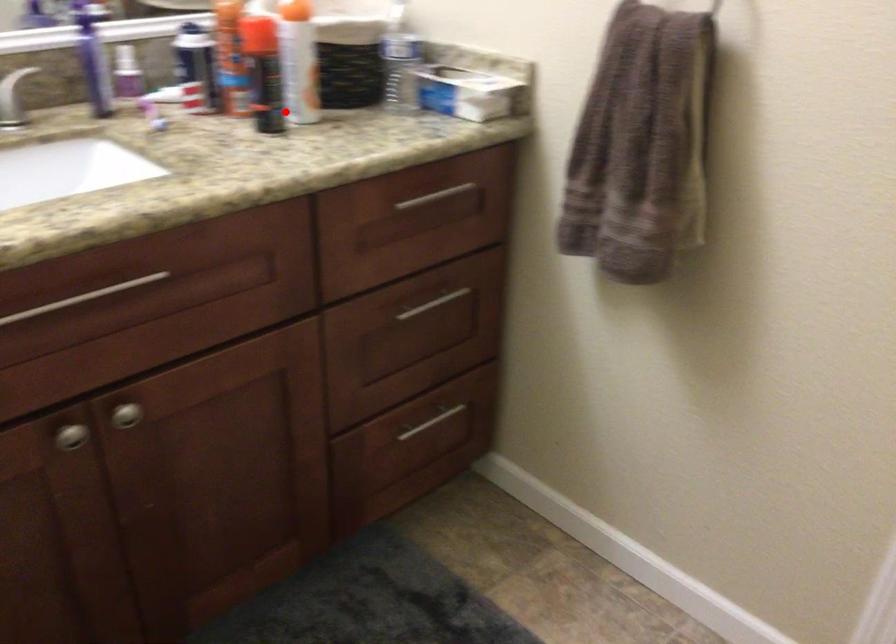
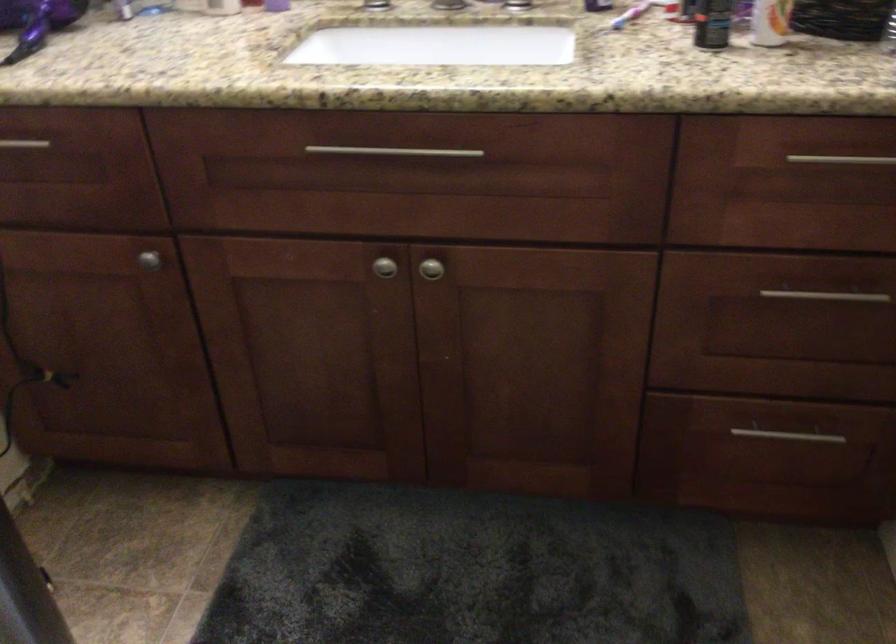
Find the pixel in the second image that matches the highlighted location in the first image.

(712, 23)